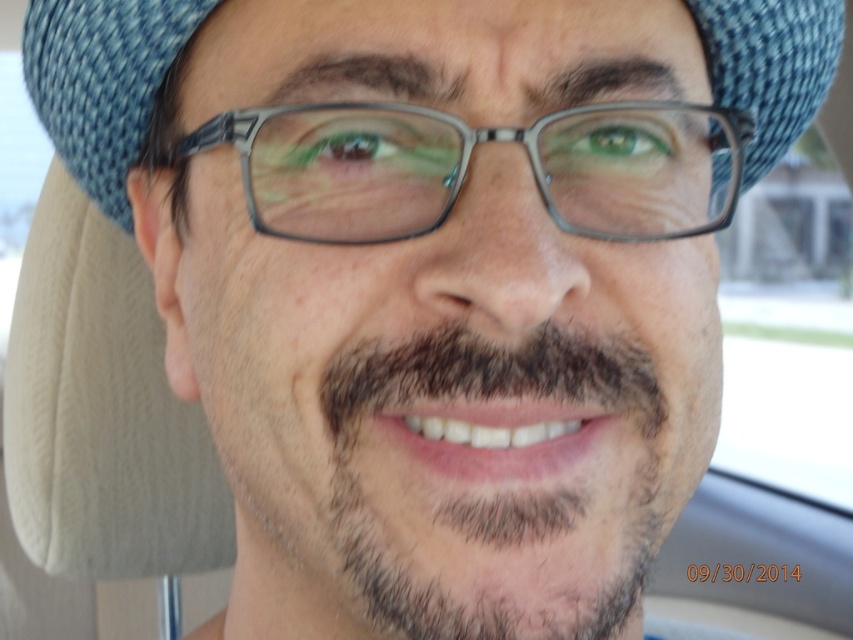
Question: Which object is farther from the camera taking this photo?

Choices:
 (A) dark brown fuzzy beard at center
 (B) blue textured hat at center

Answer: (B)

Question: Which object is positioned farthest from the clear plastic glasses at center?

Choices:
 (A) dark brown fuzzy beard at center
 (B) blue textured hat at center

Answer: (A)

Question: Which object appears closest to the camera in this image?

Choices:
 (A) clear plastic glasses at center
 (B) dark brown fuzzy beard at center
 (C) blue textured hat at center

Answer: (B)

Question: Can you confirm if clear plastic glasses at center is wider than blue textured hat at center?

Choices:
 (A) no
 (B) yes

Answer: (A)

Question: Is dark brown fuzzy beard at center to the left of blue textured hat at center from the viewer's perspective?

Choices:
 (A) no
 (B) yes

Answer: (B)

Question: Is dark brown fuzzy beard at center thinner than clear plastic glasses at center?

Choices:
 (A) yes
 (B) no

Answer: (A)